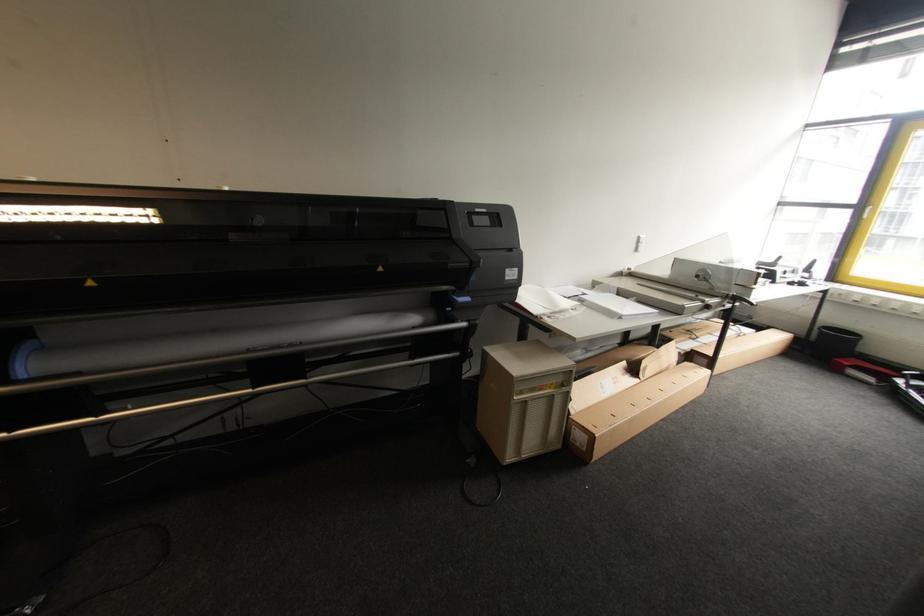
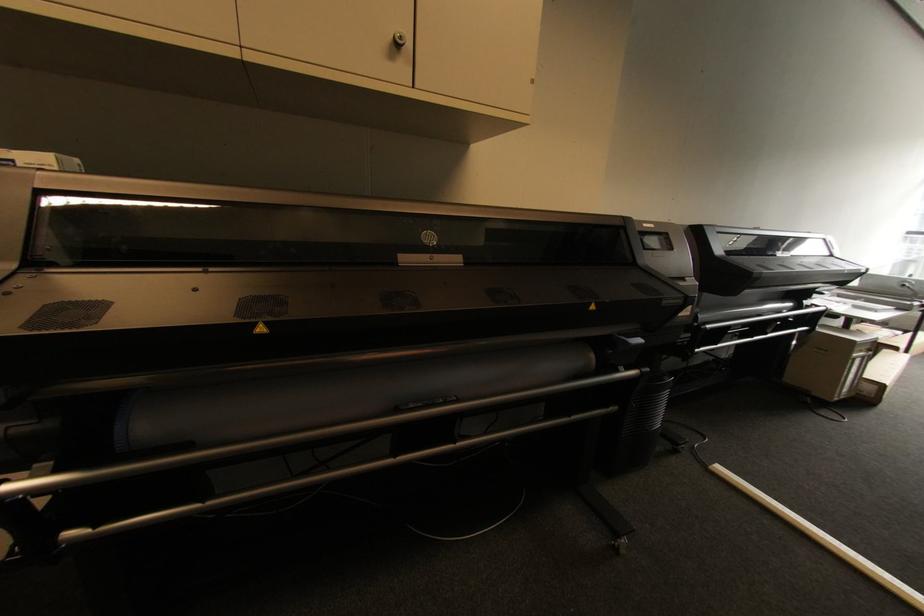
Where in the second image is the point corresponding to (545,389) from the first image?

(867, 352)